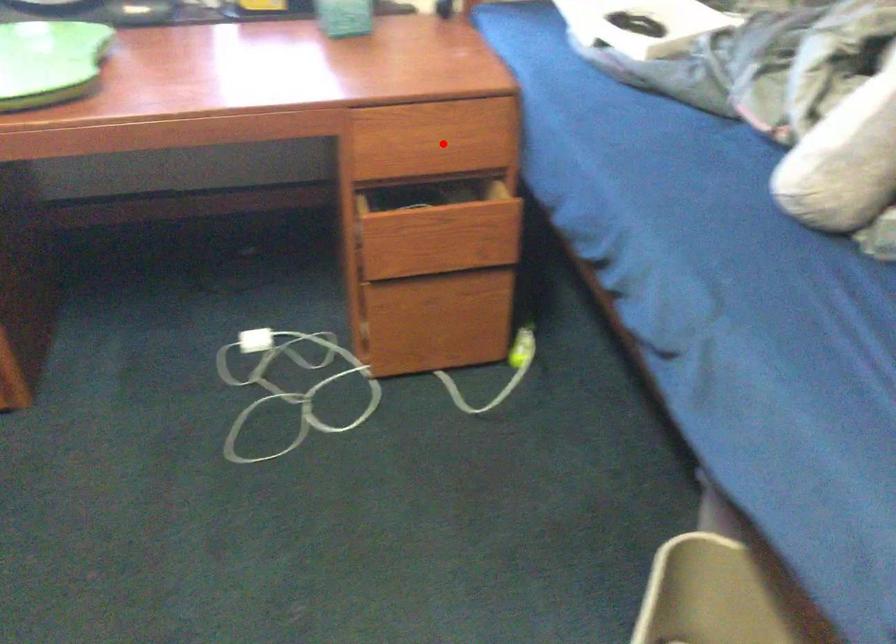
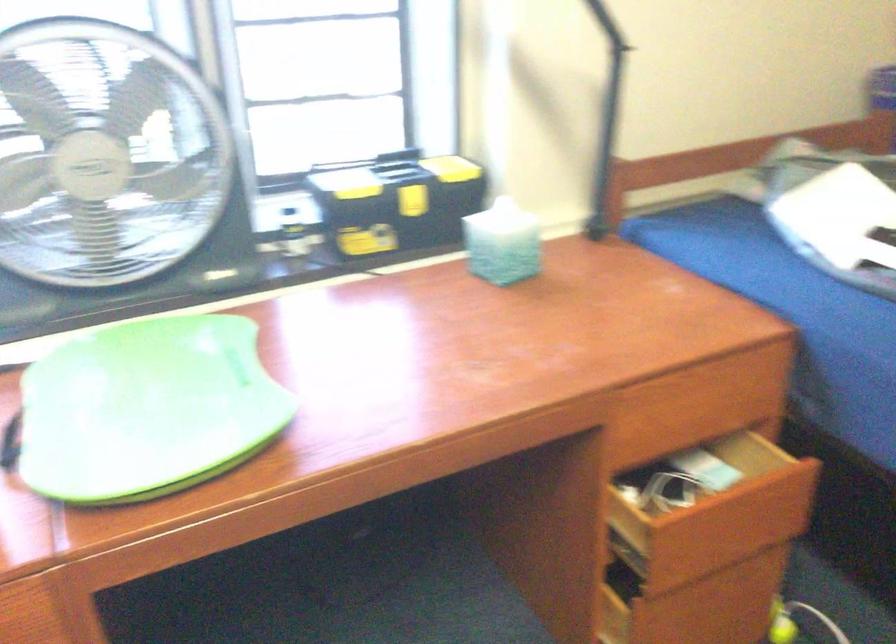
Question: I am providing you with two images of the same scene from different viewpoints. A red point is marked on the first image. At the location where the point appears in image 1, is it still visible in image 2?

Choices:
 (A) Yes
 (B) No

Answer: (A)